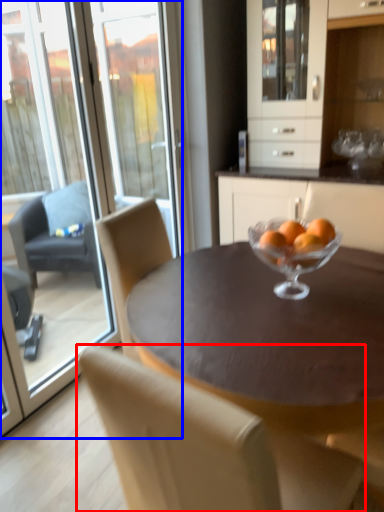
Question: Which object is further to the camera taking this photo, chair (highlighted by a red box) or screen door (highlighted by a blue box)?

Choices:
 (A) chair
 (B) screen door

Answer: (B)